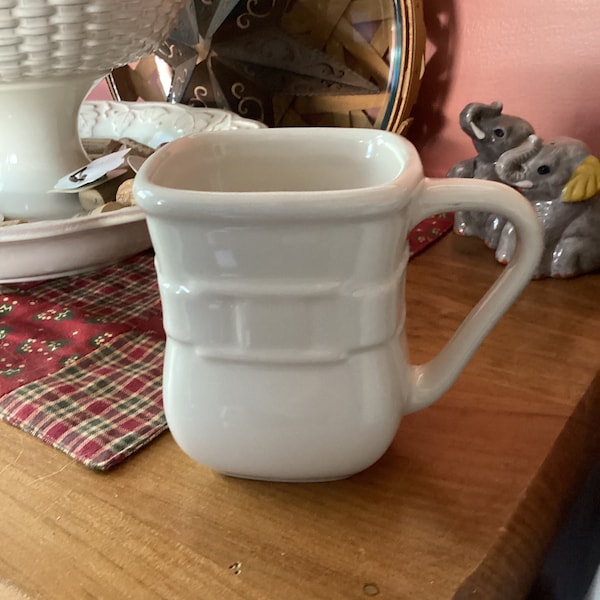
At what (x,y) coordinates should I click in order to perform the action: click on basket. Please return your answer as a coordinate pair (x, y). This screenshot has height=600, width=600. Looking at the image, I should click on (60, 19).